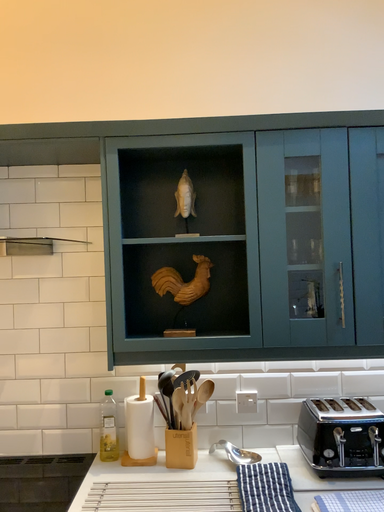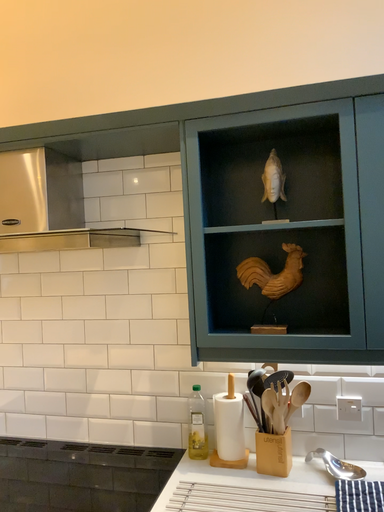
Question: How did the camera likely rotate when shooting the video?

Choices:
 (A) rotated right
 (B) rotated left

Answer: (B)